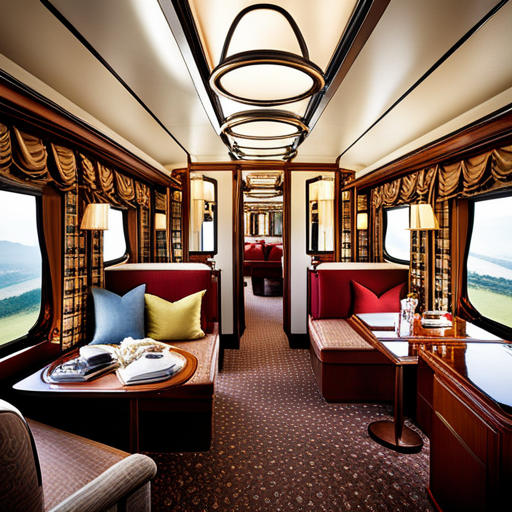
The image size is (512, 512). What are the coordinates of `ceiling` in the screenshot? It's located at (128, 23).